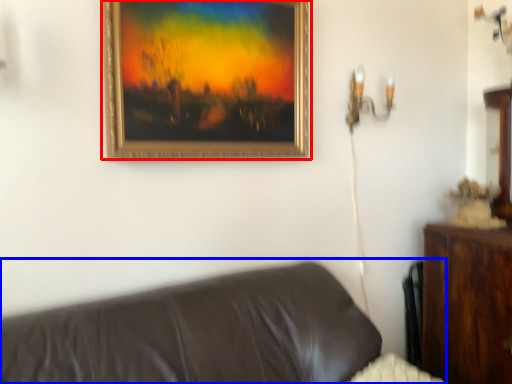
Question: Which object is further to the camera taking this photo, picture frame (highlighted by a red box) or studio couch (highlighted by a blue box)?

Choices:
 (A) picture frame
 (B) studio couch

Answer: (A)